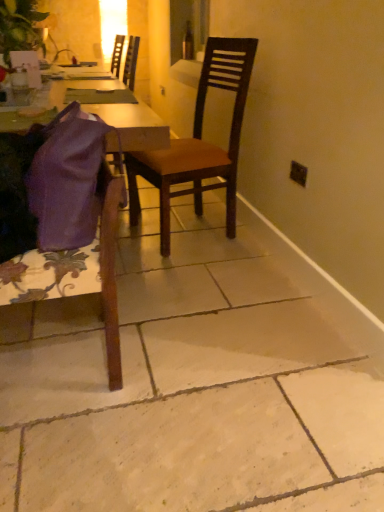
Question: From the image's perspective, would you say brown wooden chair at center, arranged as the second chair when viewed from the front, is positioned over purple fabric bag at lower left, the 2th chair from the back?

Choices:
 (A) yes
 (B) no

Answer: (A)

Question: From the image's perspective, is brown wooden chair at center, the 1th chair when ordered from back to front, below purple fabric bag at lower left, the 2th chair from the back?

Choices:
 (A) yes
 (B) no

Answer: (B)

Question: From a real-world perspective, is brown wooden chair at center, arranged as the second chair when viewed from the front, positioned under purple fabric bag at lower left, the 2th chair from the back, based on gravity?

Choices:
 (A) no
 (B) yes

Answer: (A)

Question: Can you confirm if brown wooden chair at center, the 1th chair when ordered from back to front, is shorter than purple fabric bag at lower left, the 2th chair from the back?

Choices:
 (A) yes
 (B) no

Answer: (B)

Question: Is brown wooden chair at center, the 1th chair when ordered from back to front, located outside purple fabric bag at lower left, the 2th chair from the back?

Choices:
 (A) yes
 (B) no

Answer: (A)

Question: Are brown wooden chair at center, arranged as the second chair when viewed from the front, and purple fabric bag at lower left, the 1th chair from the front, beside each other?

Choices:
 (A) yes
 (B) no

Answer: (B)

Question: From a real-world perspective, is black plastic power outlet at upper right beneath brown wooden chair at center, the 1th chair when ordered from back to front?

Choices:
 (A) no
 (B) yes

Answer: (B)

Question: Can you confirm if black plastic power outlet at upper right is smaller than brown wooden chair at center, the 1th chair when ordered from back to front?

Choices:
 (A) yes
 (B) no

Answer: (A)

Question: Is black plastic power outlet at upper right positioned beyond the bounds of brown wooden chair at center, arranged as the second chair when viewed from the front?

Choices:
 (A) yes
 (B) no

Answer: (A)

Question: Is black plastic power outlet at upper right far away from brown wooden chair at center, arranged as the second chair when viewed from the front?

Choices:
 (A) yes
 (B) no

Answer: (B)

Question: From the image's perspective, is black plastic power outlet at upper right above brown wooden chair at center, the 1th chair when ordered from back to front?

Choices:
 (A) no
 (B) yes

Answer: (A)

Question: Is black plastic power outlet at upper right in contact with brown wooden chair at center, the 1th chair when ordered from back to front?

Choices:
 (A) no
 (B) yes

Answer: (A)

Question: Considering the relative positions of purple fabric bag at lower left, the 1th chair from the front, and purple fabric at left in the image provided, is purple fabric bag at lower left, the 1th chair from the front, to the left of purple fabric at left from the viewer's perspective?

Choices:
 (A) no
 (B) yes

Answer: (A)